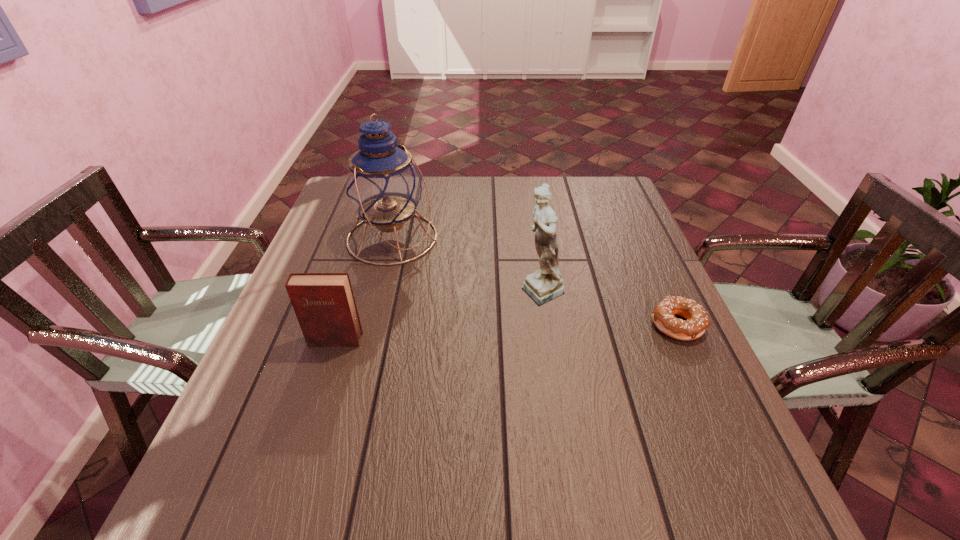
Locate an element on the screen. This screenshot has width=960, height=540. vacant point at the far edge is located at coordinates (512, 180).

Identify the location of free location at the near edge of the desktop. (387, 437).

At what (x,y) coordinates should I click in order to perform the action: click on free space at the left edge of the desktop. Please return your answer as a coordinate pair (x, y). Image resolution: width=960 pixels, height=540 pixels. Looking at the image, I should click on (244, 408).

In the image, there is a desktop. Find the location of `free space at the right edge`. free space at the right edge is located at coordinates (609, 233).

Identify the location of empty location between the third object from left to right and the doughnut. (610, 308).

I want to click on unoccupied position between the lantern and the diary, so click(364, 289).

Locate an element on the screen. This screenshot has height=540, width=960. free spot between the doughnut and the third object from left to right is located at coordinates (610, 308).

Where is `free space between the second shortest object and the farthest object`? free space between the second shortest object and the farthest object is located at coordinates (364, 289).

Locate an element on the screen. The height and width of the screenshot is (540, 960). vacant area that lies between the second shortest object and the figurine is located at coordinates (439, 316).

In order to click on free space between the shortest object and the third shortest object in this screenshot , I will do `click(610, 308)`.